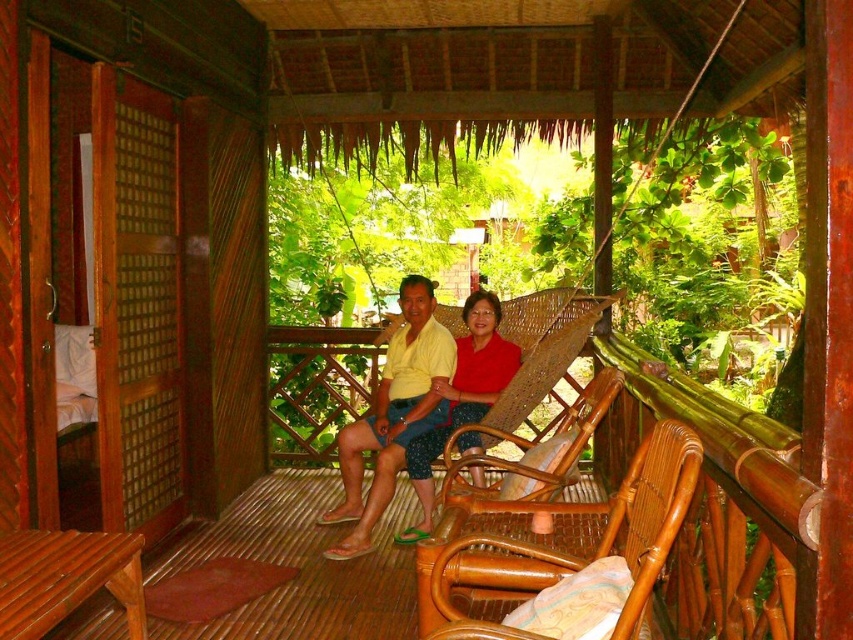
Question: Is yellow matte shirt at center smaller than woven rattan chair at center?

Choices:
 (A) no
 (B) yes

Answer: (A)

Question: Observing the image, what is the correct spatial positioning of rattan chair at center in reference to matte red blouse at center?

Choices:
 (A) left
 (B) right

Answer: (B)

Question: Considering the real-world distances, which object is farthest from the matte red blouse at center?

Choices:
 (A) rattan chair at center
 (B) woven rattan chair at center

Answer: (A)

Question: Which object is farther from the camera taking this photo?

Choices:
 (A) yellow matte shirt at center
 (B) rattan chair at center

Answer: (A)

Question: Can you confirm if rattan chair at center is bigger than matte red blouse at center?

Choices:
 (A) yes
 (B) no

Answer: (B)

Question: Which object is the closest to the yellow matte shirt at center?

Choices:
 (A) rattan chair at center
 (B) matte red blouse at center
 (C) woven rattan chair at center

Answer: (B)